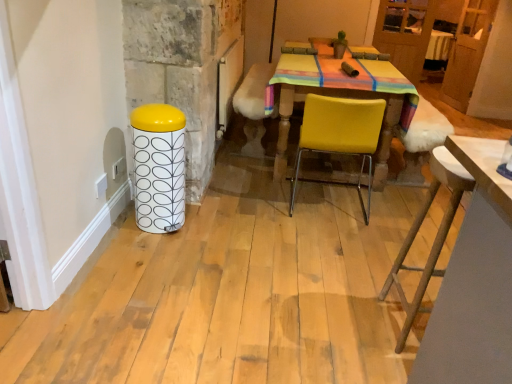
At what (x,y) coordinates should I click in order to perform the action: click on vacant space to the right of white glossy trash can at left. Please return your answer as a coordinate pair (x, y). Looking at the image, I should click on 202,226.